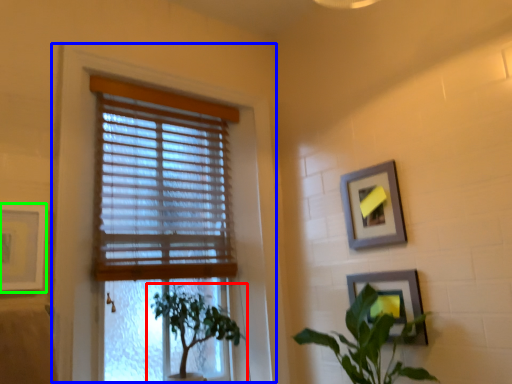
Question: Which is farther away from houseplant (highlighted by a red box)? window frame (highlighted by a blue box) or picture frame (highlighted by a green box)?

Choices:
 (A) window frame
 (B) picture frame

Answer: (B)